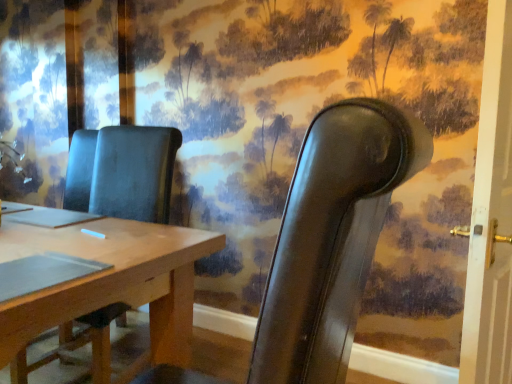
Question: In terms of width, does white painted wood door at right look wider or thinner when compared to leather chair at right, which appears as the 1th chair when viewed from the right?

Choices:
 (A) wide
 (B) thin

Answer: (B)

Question: Is white painted wood door at right in front of or behind leather chair at right, acting as the 2th chair starting from the left, in the image?

Choices:
 (A) behind
 (B) front

Answer: (A)

Question: Estimate the real-world distances between objects in this image. Which object is closer to the leather chair at right, acting as the 2th chair starting from the left?

Choices:
 (A) matte brown chair at center, which is counted as the 2th chair, starting from the right
 (B) white painted wood door at right

Answer: (B)

Question: Based on their relative distances, which object is nearer to the white painted wood door at right?

Choices:
 (A) matte brown chair at center, which is the 1th chair in left-to-right order
 (B) leather chair at right, acting as the 2th chair starting from the left

Answer: (B)